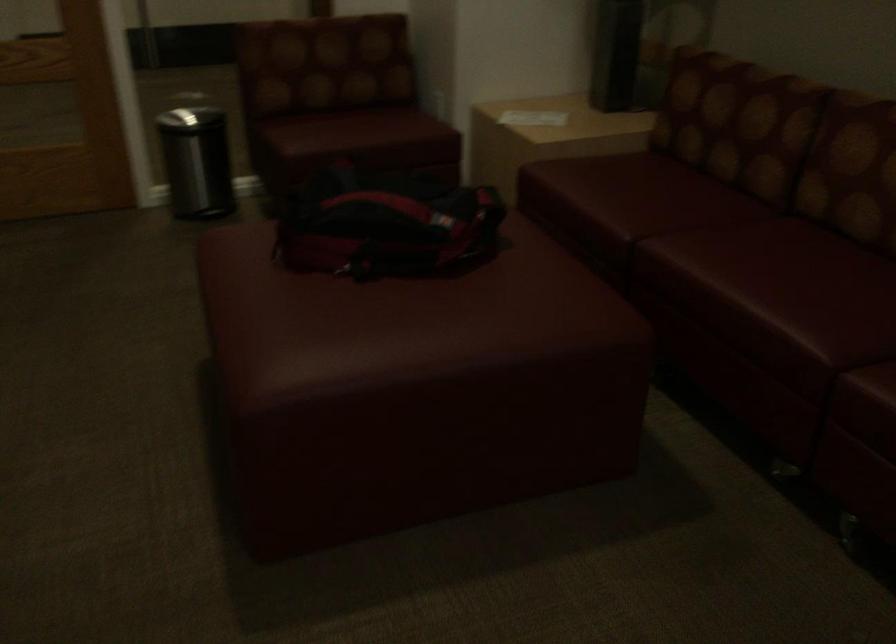
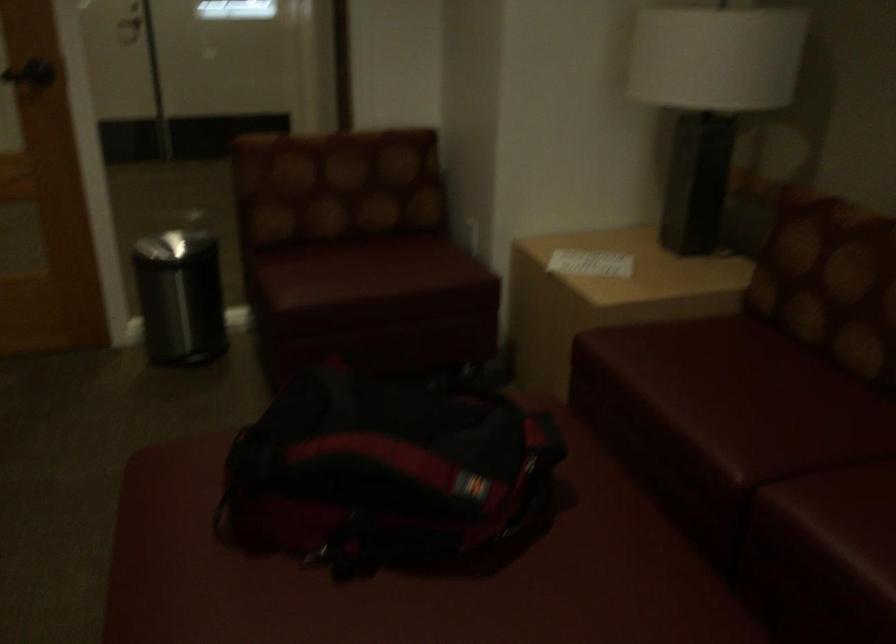
In the second image, find the point that corresponds to point 383,211 in the first image.

(384, 471)